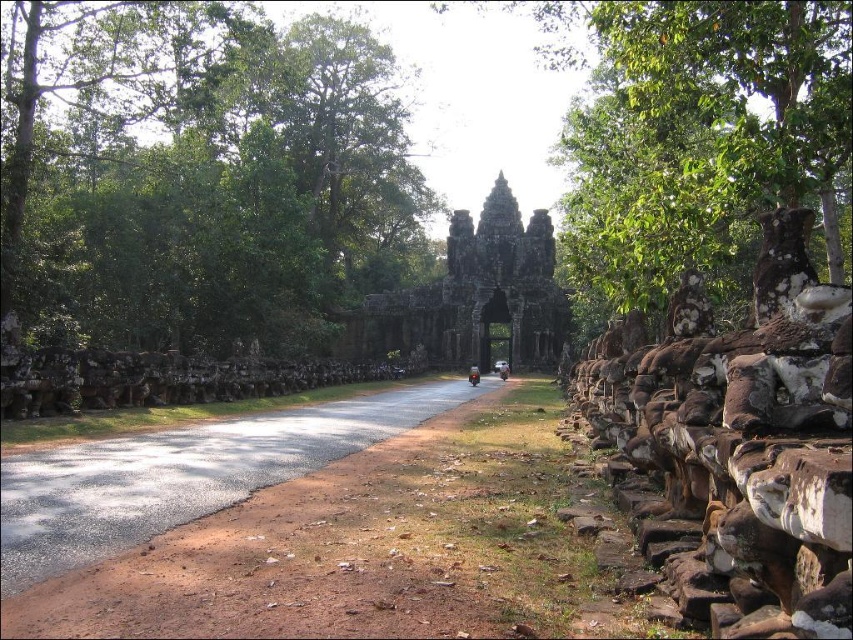
You are a tour guide leading a group to the dark stone gate at center and the shiny red motorcycle at center. You need to decide which one is wider. Can you determine this based on the scene?

The dark stone gate at center might be wider than shiny red motorcycle at center, so it is possible that the dark stone gate at center is wider than the shiny red motorcycle at center.

You are a tourist standing at the entrance of the temple complex. You see the green leafy trees at upper left and the shiny red motorcycle at center. Which object is positioned to the left of the other?

The green leafy trees at upper left are positioned to the left of the shiny red motorcycle at center.